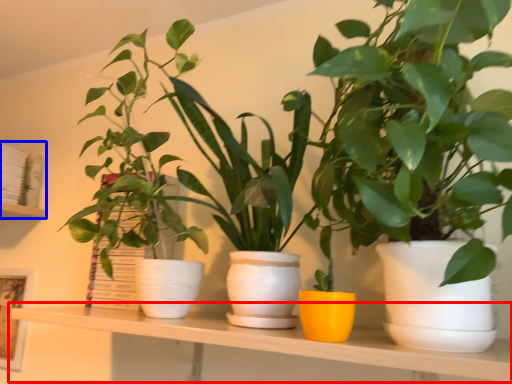
Question: Which point is closer to the camera, table (highlighted by a red box) or shelf (highlighted by a blue box)?

Choices:
 (A) table
 (B) shelf

Answer: (A)